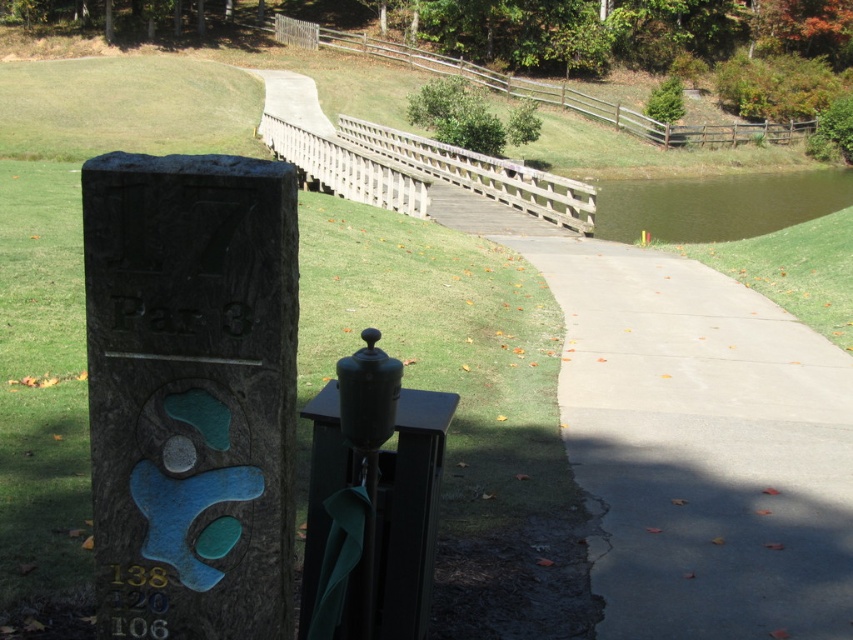
Question: Considering the real-world distances, which object is farthest from the bronze textured sign at left?

Choices:
 (A) gray concrete sidewalk at center
 (B) wooden bridge at upper center

Answer: (B)

Question: Does gray concrete sidewalk at center come in front of bronze textured sign at left?

Choices:
 (A) yes
 (B) no

Answer: (B)

Question: Which of the following is the farthest from the observer?

Choices:
 (A) greenish-brown water at lower right
 (B) wooden bridge at upper center
 (C) gray concrete sidewalk at center

Answer: (A)

Question: Is gray concrete sidewalk at center below wooden bridge at upper center?

Choices:
 (A) no
 (B) yes

Answer: (B)

Question: Which of the following is the farthest from the observer?

Choices:
 (A) (602, 579)
 (B) (408, 205)
 (C) (699, 208)
 (D) (224, 588)

Answer: (C)

Question: Is gray concrete sidewalk at center in front of bronze textured sign at left?

Choices:
 (A) yes
 (B) no

Answer: (B)